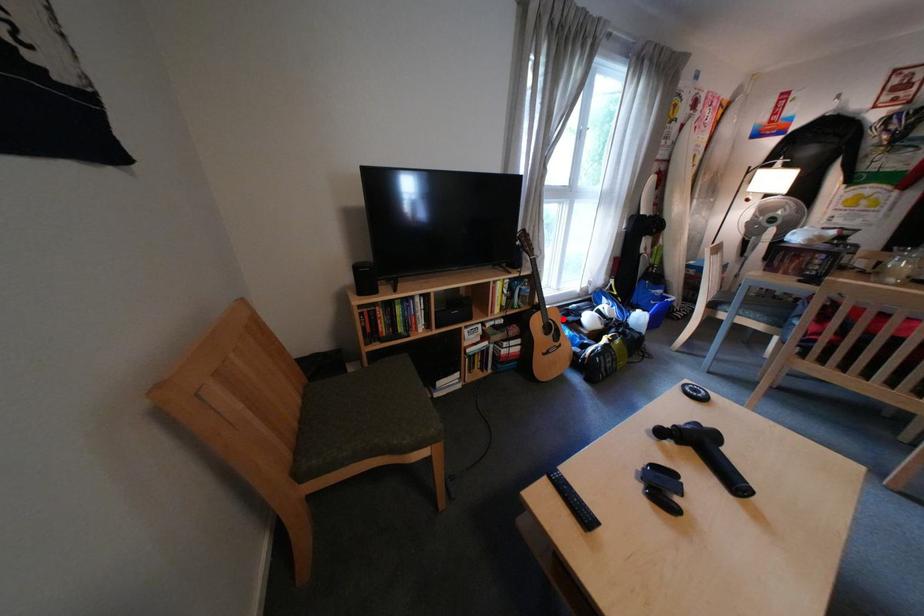
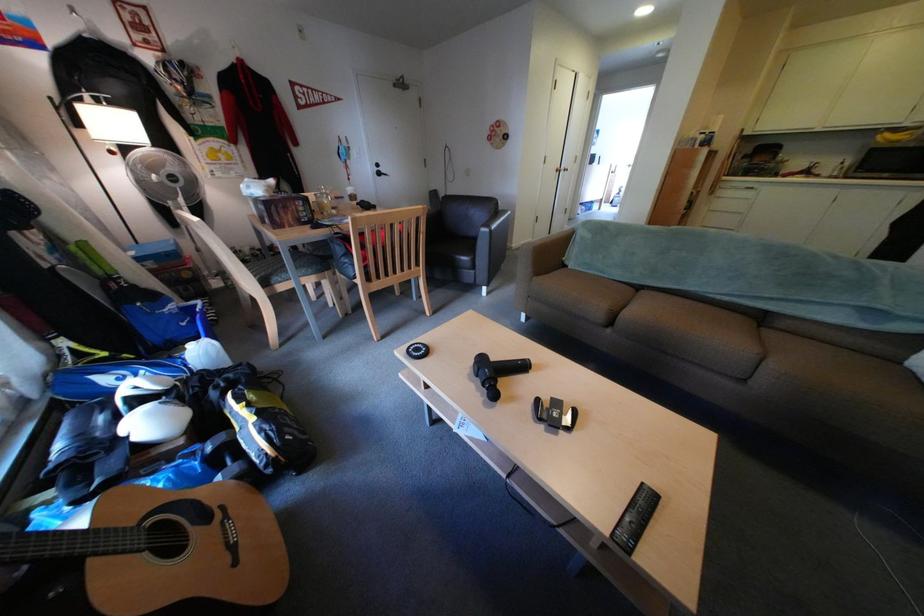
Where in the second image is the point corresponding to the highlighted location from the first image?

(148, 527)